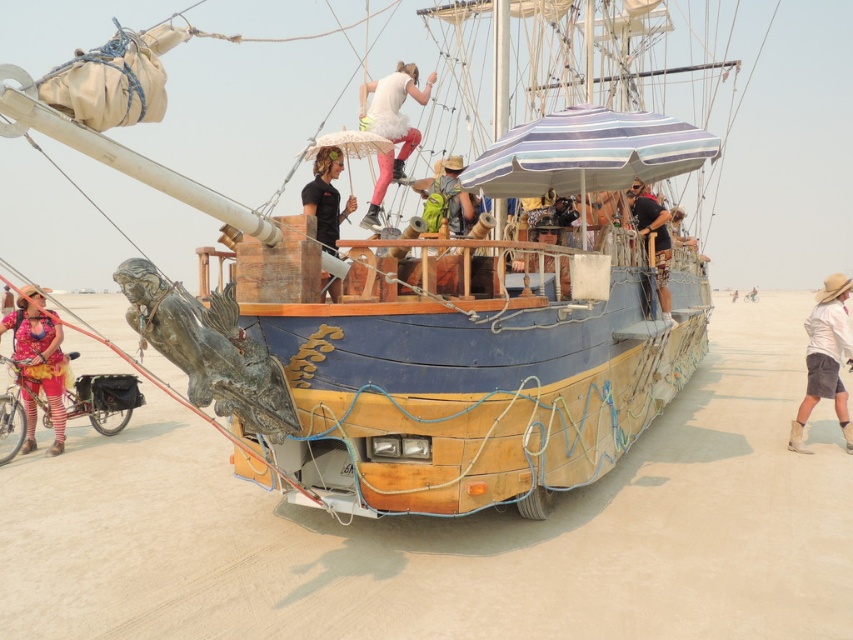
Question: Which is farther from the floral fabric dress at lower left?

Choices:
 (A) wooden boat at center
 (B) white cotton shirt at right
 (C) white fluffy tutu at upper center

Answer: (B)

Question: Is white fluffy tutu at upper center bigger than matte black shirt at upper center?

Choices:
 (A) no
 (B) yes

Answer: (A)

Question: Which point appears closest to the camera in this image?

Choices:
 (A) (334, 225)
 (B) (56, 406)

Answer: (A)

Question: Is the position of white cotton shirt at right more distant than that of matte black shirt at upper center?

Choices:
 (A) yes
 (B) no

Answer: (A)

Question: Does floral fabric dress at lower left appear on the left side of matte black shirt at upper center?

Choices:
 (A) yes
 (B) no

Answer: (A)

Question: Based on their relative distances, which object is nearer to the wooden boat at center?

Choices:
 (A) matte black shirt at upper center
 (B) white cotton shirt at right
 (C) floral fabric dress at lower left
 (D) white fluffy tutu at upper center

Answer: (A)